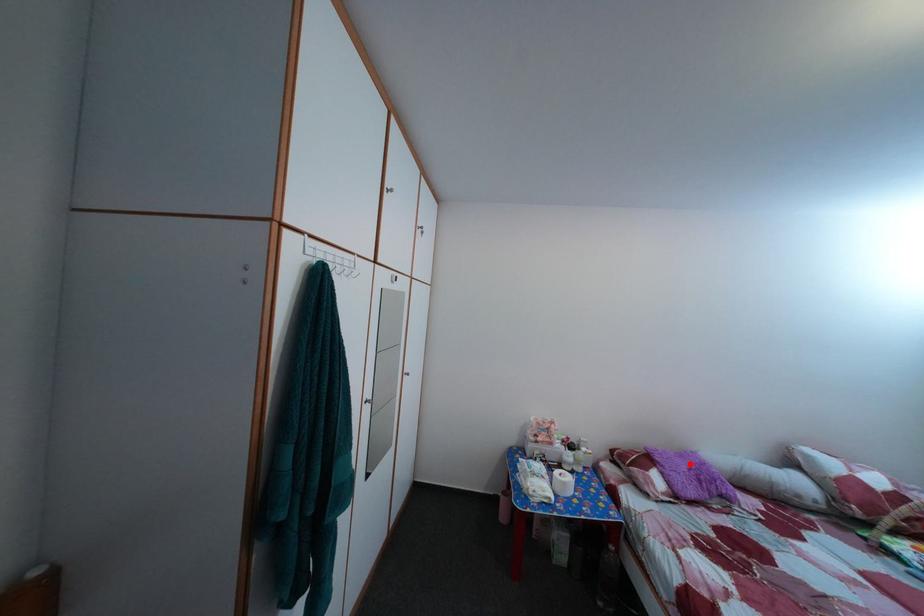
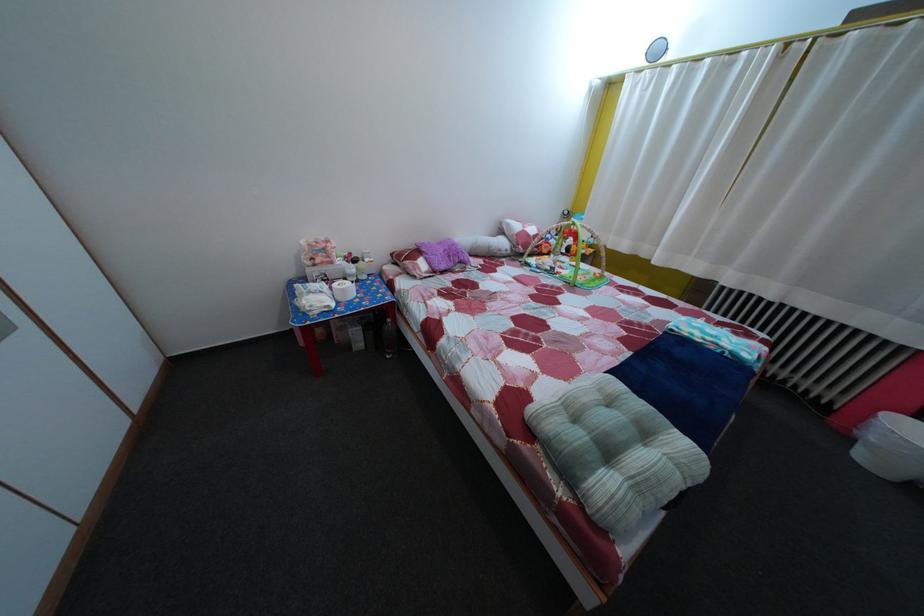
In the second image, find the point that corresponds to the highlighted location in the first image.

(450, 252)